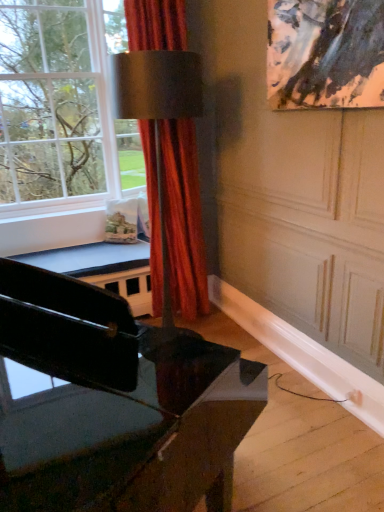
Question: Can you confirm if black glossy piano at lower left is bigger than satin red curtain at center?

Choices:
 (A) no
 (B) yes

Answer: (B)

Question: From a real-world perspective, is black glossy piano at lower left positioned over satin red curtain at center based on gravity?

Choices:
 (A) no
 (B) yes

Answer: (A)

Question: Are black glossy piano at lower left and satin red curtain at center located far from each other?

Choices:
 (A) no
 (B) yes

Answer: (B)

Question: Is black glossy piano at lower left completely or partially outside of satin red curtain at center?

Choices:
 (A) yes
 (B) no

Answer: (A)

Question: Would you say black glossy piano at lower left contains satin red curtain at center?

Choices:
 (A) no
 (B) yes

Answer: (A)

Question: From the image's perspective, does black glossy piano at lower left appear higher than satin red curtain at center?

Choices:
 (A) no
 (B) yes

Answer: (A)

Question: Considering the relative positions of satin red curtain at center and black glossy piano at lower left in the image provided, is satin red curtain at center to the left of black glossy piano at lower left from the viewer's perspective?

Choices:
 (A) yes
 (B) no

Answer: (B)

Question: Is satin red curtain at center looking in the opposite direction of black glossy piano at lower left?

Choices:
 (A) no
 (B) yes

Answer: (A)

Question: Does satin red curtain at center have a smaller size compared to black glossy piano at lower left?

Choices:
 (A) yes
 (B) no

Answer: (A)

Question: From a real-world perspective, is satin red curtain at center over black glossy piano at lower left?

Choices:
 (A) no
 (B) yes

Answer: (B)

Question: Is there a large distance between satin red curtain at center and black glossy piano at lower left?

Choices:
 (A) no
 (B) yes

Answer: (B)

Question: Is satin red curtain at center thinner than black glossy piano at lower left?

Choices:
 (A) yes
 (B) no

Answer: (A)

Question: Is clear glass window at upper left positioned far away from satin red curtain at center?

Choices:
 (A) yes
 (B) no

Answer: (B)